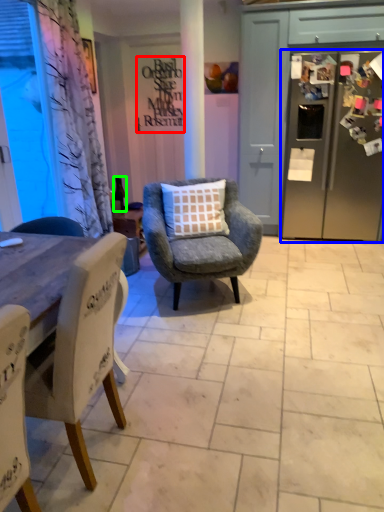
Question: Which object is the farthest from writing (highlighted by a red box)? Choose among these: refrigerator (highlighted by a blue box) or bottle (highlighted by a green box).

Choices:
 (A) refrigerator
 (B) bottle

Answer: (A)